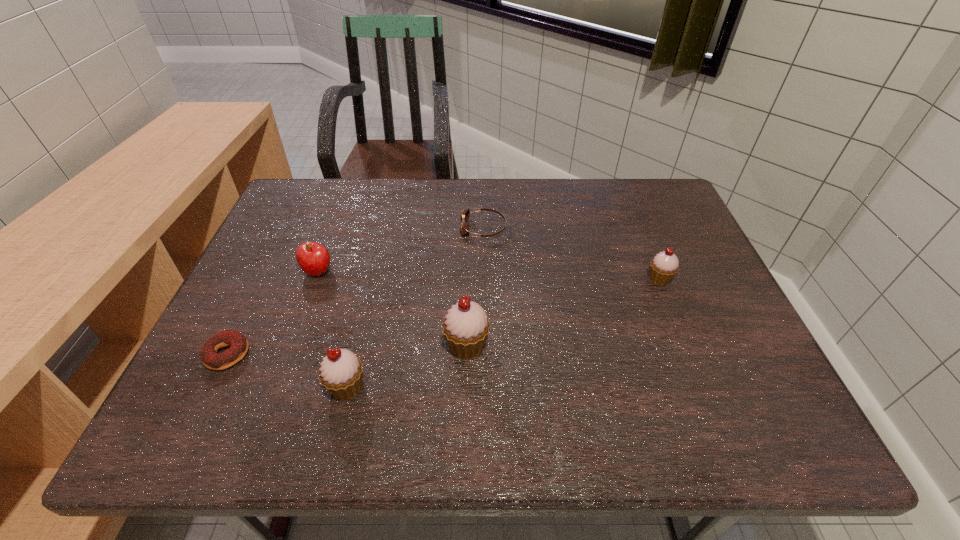
At what (x,y) coordinates should I click in order to perform the action: click on free region located 0.400m on the right of the tallest object. Please return your answer as a coordinate pair (x, y). Image resolution: width=960 pixels, height=540 pixels. Looking at the image, I should click on (673, 346).

Locate an element on the screen. The width and height of the screenshot is (960, 540). free spot located 0.360m on the back of the farthest cupcake is located at coordinates (623, 190).

The width and height of the screenshot is (960, 540). Find the location of `free space located on the right of the fifth object from right to left`. free space located on the right of the fifth object from right to left is located at coordinates (479, 271).

This screenshot has width=960, height=540. Find the location of `vacant area situated through the lenses of the goggles`. vacant area situated through the lenses of the goggles is located at coordinates (330, 228).

Locate an element on the screen. vacant point located through the lenses of the goggles is located at coordinates (383, 228).

I want to click on free space located 0.200m through the lenses of the goggles, so click(x=391, y=228).

The width and height of the screenshot is (960, 540). In order to click on free location located 0.070m on the right of the leftmost object in this screenshot , I will do `click(281, 354)`.

Identify the location of object that is at the far edge. (464, 230).

Where is `doughnut situated at the near edge`? The width and height of the screenshot is (960, 540). doughnut situated at the near edge is located at coordinates (238, 343).

The height and width of the screenshot is (540, 960). I want to click on apple located at the left edge, so click(313, 258).